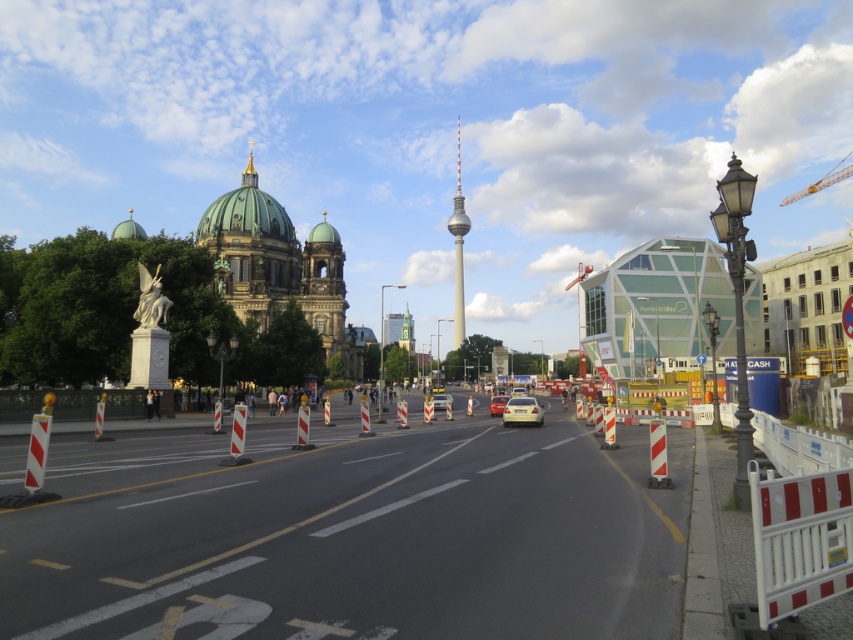
Question: Considering the relative positions of smooth gray tower at center and yellow matte car at center in the image provided, where is smooth gray tower at center located with respect to yellow matte car at center?

Choices:
 (A) below
 (B) above

Answer: (B)

Question: Which of the following is the closest to the observer?

Choices:
 (A) (450, 406)
 (B) (525, 396)
 (C) (228, 492)

Answer: (C)

Question: Is green stone dome at center above matte white sedan at center?

Choices:
 (A) no
 (B) yes

Answer: (B)

Question: Which object appears closest to the camera in this image?

Choices:
 (A) white plastic barricade at lower right
 (B) yellow matte car at center
 (C) white plastic barricades at center
 (D) green stone dome at center

Answer: (A)

Question: Which point is farther to the camera?

Choices:
 (A) smooth gray tower at center
 (B) green stone dome at center
 (C) matte silver sedan at center
 (D) white plastic traffic cone at center

Answer: (A)

Question: Can you confirm if green stone dome at center is thinner than matte white sedan at center?

Choices:
 (A) yes
 (B) no

Answer: (B)